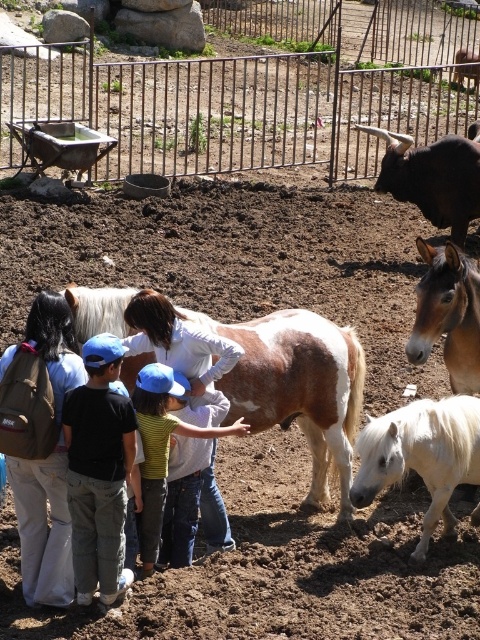
You are a photographer standing at the center of the paddock. You want to take a photo of the black glossy cow at upper right while also including the black cotton shirt at center in the frame. Given that your camera has a maximum zoom range of 5 meters, will you be able to capture both objects in the same photo without moving closer?

The black cotton shirt at center and black glossy cow at upper right are 6.59 meters apart. Since the camera can only zoom up to 5 meters, you cannot capture both objects in the same photo without moving closer.

In the scene shown: You are standing at the position of point (417,81) and want to walk to the wheelbarrow. There is a point at (354,321) in your path. Is this point in front of or behind you relative to your direction of travel?

The point at (354,321) is in front of point (417,81), so it is in front of you as you walk towards the wheelbarrow.

You are a visitor at the farm and need to decide where to place your belongings. You have a brown backpack at left and a black cotton shirt at center. Which item takes up more space in your bag?

The brown backpack at left is larger in size than the black cotton shirt at center, so the brown backpack at left takes up more space in your bag.